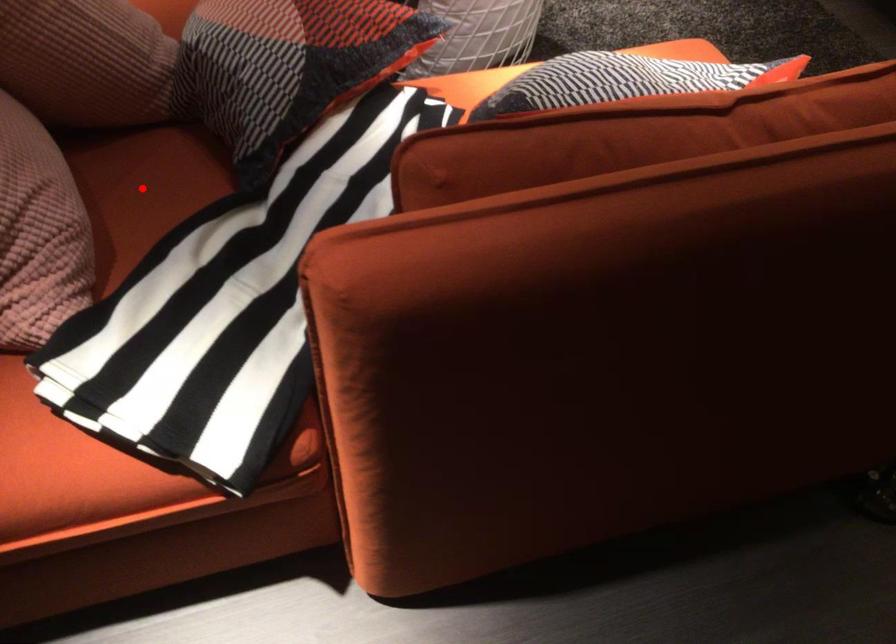
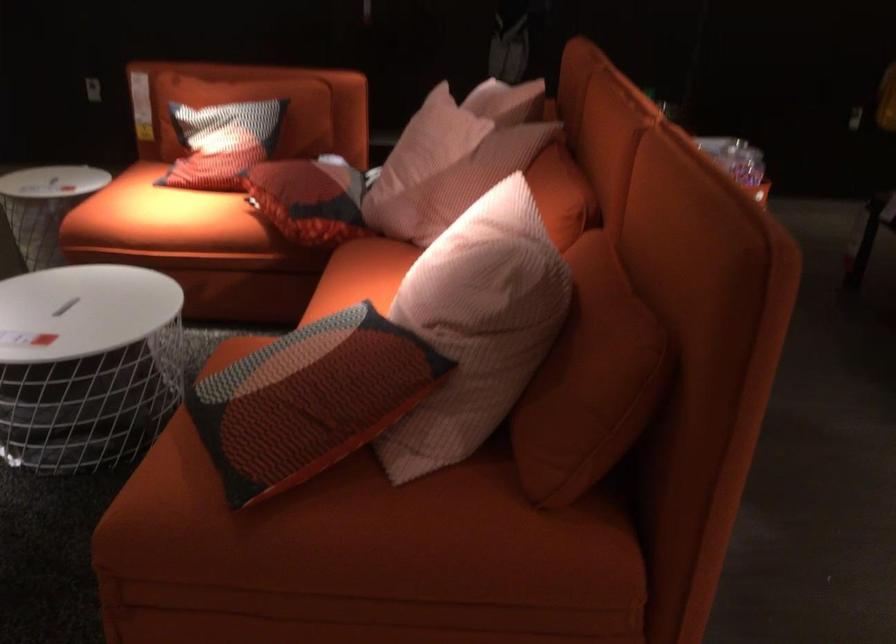
Question: I am providing you with two images of the same scene from different viewpoints. A red point is marked on the first image. Is the red point's position out of view in image 2?

Choices:
 (A) Yes
 (B) No

Answer: (A)